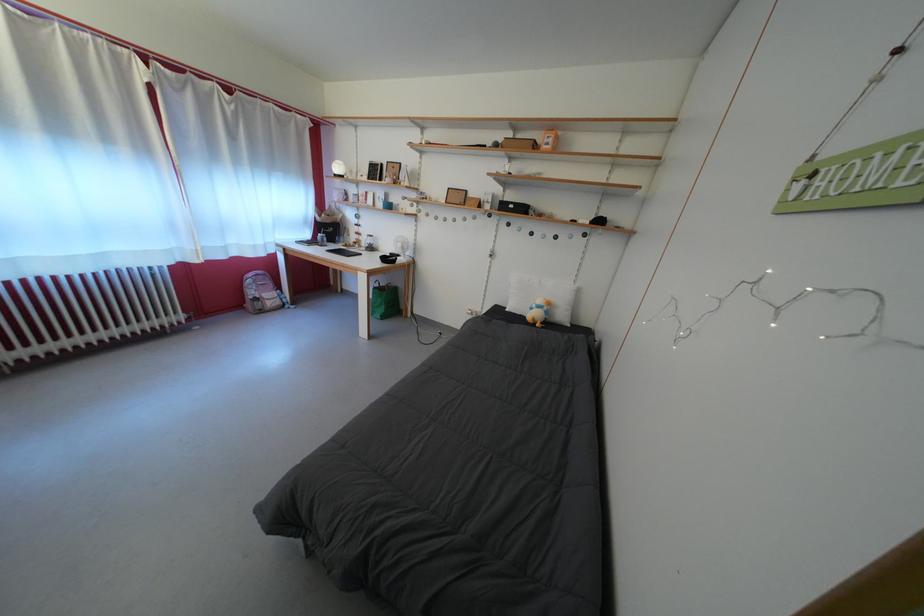
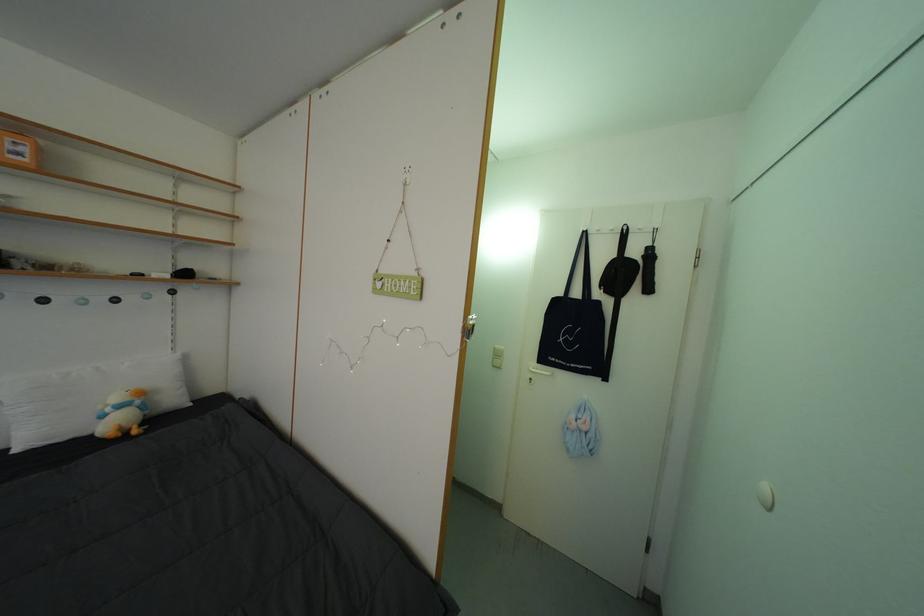
Where in the second image is the point corresponding to pixel 555 150 from the first image?

(27, 160)